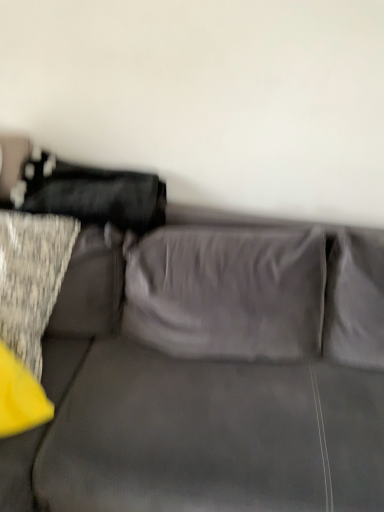
Identify the location of suede gray couch at center. (210, 374).

The width and height of the screenshot is (384, 512). What do you see at coordinates (210, 374) in the screenshot?
I see `suede gray couch at center` at bounding box center [210, 374].

The image size is (384, 512). I want to click on suede gray couch at center, so click(x=210, y=374).